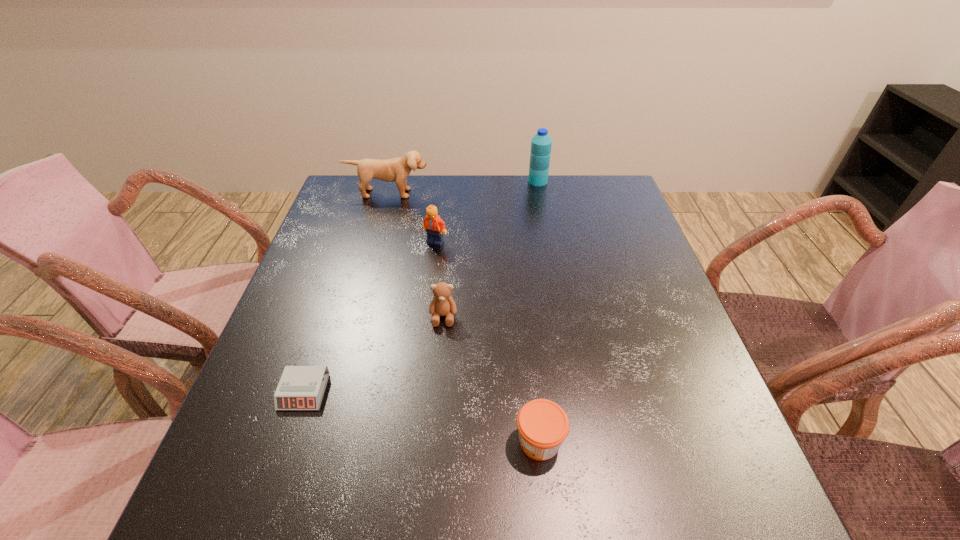
Locate an element on the screen. The width and height of the screenshot is (960, 540). the shortest object is located at coordinates (301, 387).

Identify the location of the second nearest object. (301, 387).

The image size is (960, 540). I want to click on free location located on the front of the tallest object, so click(x=545, y=225).

Where is `free space located on the left side of the second tallest object`? This screenshot has height=540, width=960. free space located on the left side of the second tallest object is located at coordinates (376, 234).

The height and width of the screenshot is (540, 960). I want to click on free space located on the front-facing side of the third farthest object, so click(x=427, y=305).

Where is `vacant space located 0.110m on the front-facing side of the third shortest object`? vacant space located 0.110m on the front-facing side of the third shortest object is located at coordinates (439, 370).

Locate an element on the screen. This screenshot has width=960, height=540. free space located on the front label of the jam is located at coordinates (434, 441).

The width and height of the screenshot is (960, 540). I want to click on free space located 0.400m on the front label of the jam, so click(x=284, y=441).

Identify the location of free region located 0.100m on the front label of the jam. (457, 441).

You are a GUI agent. You are given a task and a screenshot of the screen. Output one action in this format:
    pyautogui.click(x=<x>, y=<y>)
    Task: Click on the free space located 0.150m on the back of the fifth farthest object
    This screenshot has width=960, height=540.
    Given the screenshot: What is the action you would take?
    pyautogui.click(x=329, y=317)